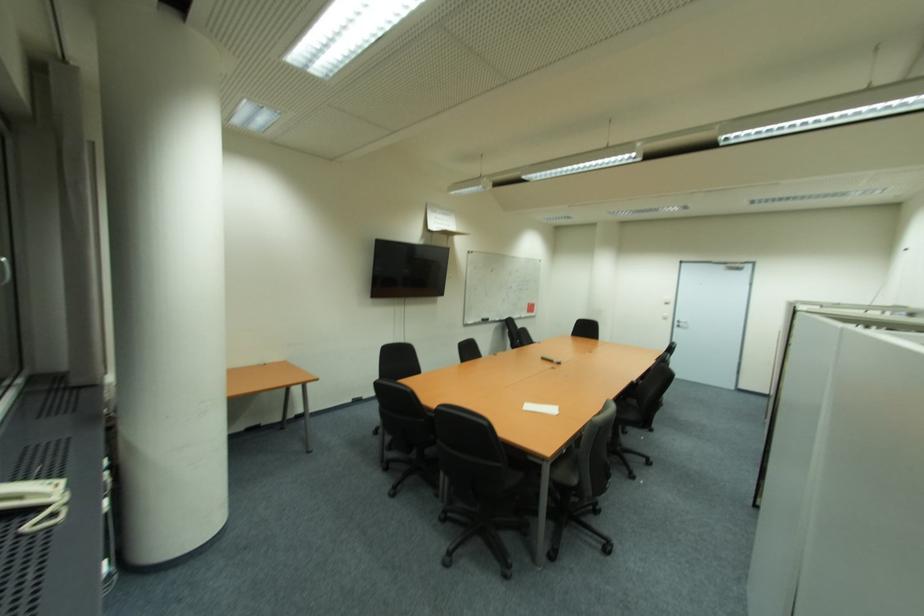
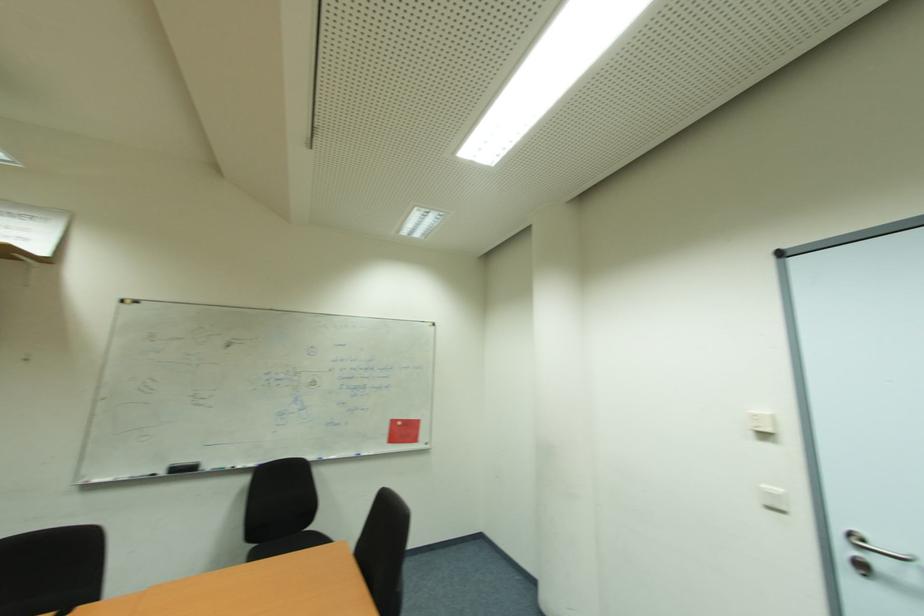
Locate, in the second image, the point that corresponds to point 672,315 in the first image.

(784, 492)